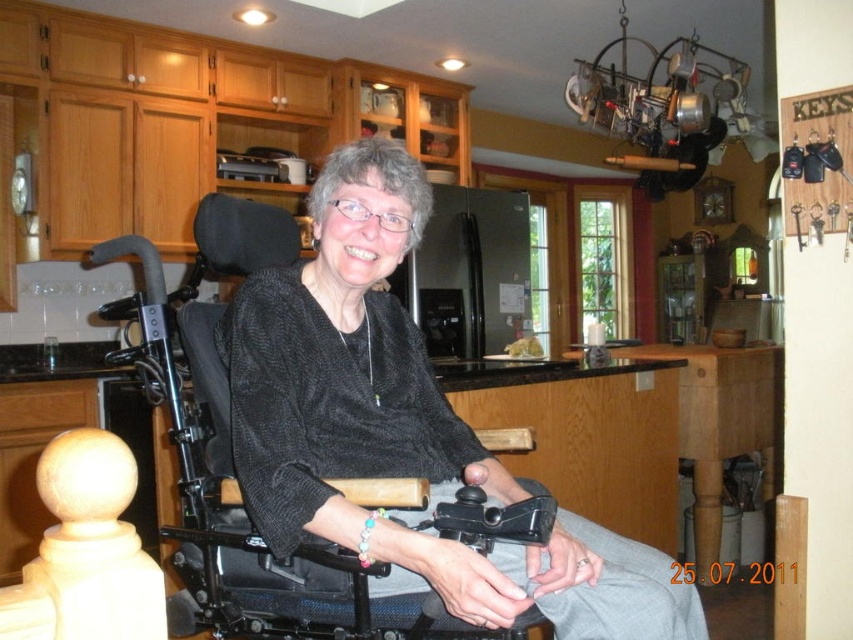
Question: Among these points, which one is nearest to the camera?

Choices:
 (A) (486, 531)
 (B) (312, 205)

Answer: (A)

Question: Does black mesh wheelchair at center have a greater width compared to black plastic video camera at lower center?

Choices:
 (A) yes
 (B) no

Answer: (A)

Question: Is the position of black mesh wheelchair at center less distant than that of black plastic video camera at lower center?

Choices:
 (A) yes
 (B) no

Answer: (B)

Question: Is black mesh wheelchair at center further to the viewer compared to black plastic video camera at lower center?

Choices:
 (A) yes
 (B) no

Answer: (A)

Question: Among these objects, which one is farthest from the camera?

Choices:
 (A) black mesh wheelchair at center
 (B) black plastic video camera at lower center

Answer: (A)